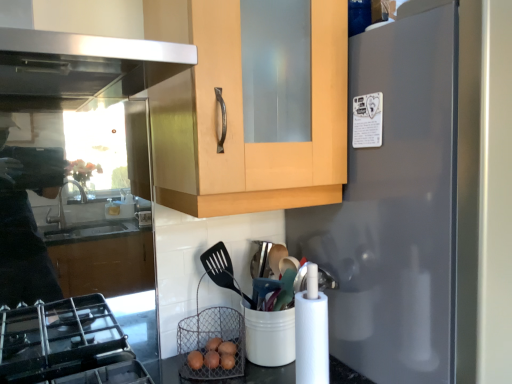
Question: Do you think brown wire basket at lower center is within satin gray refrigerator at right, or outside of it?

Choices:
 (A) inside
 (B) outside

Answer: (B)

Question: Does point (237, 317) appear closer or farther from the camera than point (379, 256)?

Choices:
 (A) closer
 (B) farther

Answer: (B)

Question: From the image's perspective, is brown wire basket at lower center located above or below satin gray refrigerator at right?

Choices:
 (A) below
 (B) above

Answer: (A)

Question: Is point (351, 243) closer or farther from the camera than point (224, 321)?

Choices:
 (A) closer
 (B) farther

Answer: (A)

Question: Would you say satin gray refrigerator at right is to the left or to the right of brown wire basket at lower center in the picture?

Choices:
 (A) left
 (B) right

Answer: (B)

Question: Considering the positions of satin gray refrigerator at right and brown wire basket at lower center in the image, is satin gray refrigerator at right wider or thinner than brown wire basket at lower center?

Choices:
 (A) wide
 (B) thin

Answer: (A)

Question: From the image's perspective, relative to brown wire basket at lower center, is satin gray refrigerator at right above or below?

Choices:
 (A) above
 (B) below

Answer: (A)